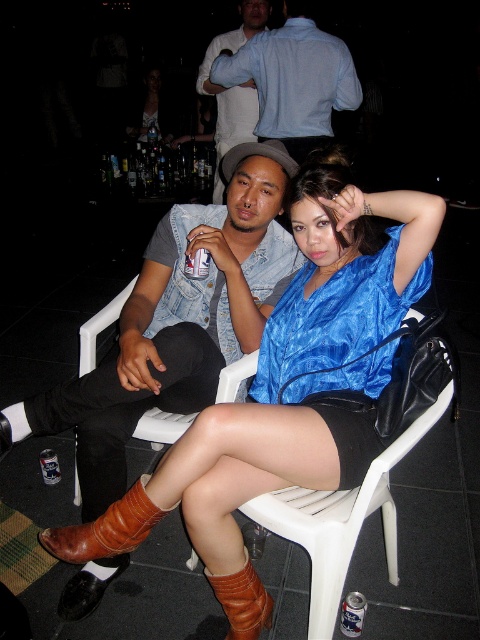
Question: Can you confirm if denim jacket at upper center is positioned to the left of brown leather boot at lower left?

Choices:
 (A) yes
 (B) no

Answer: (B)

Question: Can you confirm if blue satin dress at center is smaller than brown leather boot at lower left?

Choices:
 (A) no
 (B) yes

Answer: (A)

Question: Which point is farther to the camera?

Choices:
 (A) denim jacket at upper center
 (B) brown leather boot at lower left
 (C) matte black dress at center

Answer: (C)

Question: Does velvet blue blouse at center have a greater width compared to brown leather boot at lower left?

Choices:
 (A) no
 (B) yes

Answer: (B)

Question: Which object is positioned farthest from the matte black dress at center?

Choices:
 (A) clear plastic bottle at upper center
 (B) clear glass bottles at upper center

Answer: (A)

Question: Which object appears farthest from the camera in this image?

Choices:
 (A) brown leather boot at lower center
 (B) blue satin dress at center
 (C) clear glass bottles at upper center
 (D) velvet blue blouse at center

Answer: (C)